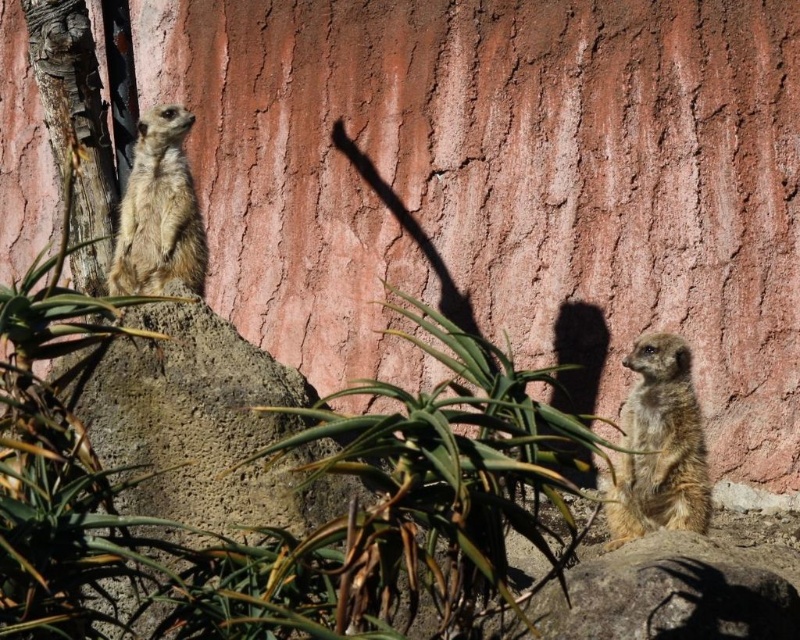
Which is in front, point (512, 396) or point (686, 356)?

Point (512, 396)

This screenshot has width=800, height=640. What do you see at coordinates (436, 490) in the screenshot?
I see `green leafy plant at center` at bounding box center [436, 490].

At what (x,y) coordinates should I click in order to perform the action: click on green leafy plant at center. Please return your answer as a coordinate pair (x, y). The image size is (800, 640). Looking at the image, I should click on pyautogui.click(x=436, y=490).

Is green leafy plant at center above golden fur meerkat at upper left?

Actually, green leafy plant at center is below golden fur meerkat at upper left.

Is green leafy plant at center shorter than golden fur meerkat at upper left?

No, green leafy plant at center is not shorter than golden fur meerkat at upper left.

Between point (505, 586) and point (182, 163), which one is positioned behind?

Point (182, 163)

Where is `green leafy plant at center`? This screenshot has height=640, width=800. green leafy plant at center is located at coordinates (436, 490).

What do you see at coordinates (660, 445) in the screenshot? I see `fuzzy brown meerkat at lower right` at bounding box center [660, 445].

Is fuzzy brown meerkat at lower right further to the viewer compared to golden fur meerkat at upper left?

No.

The height and width of the screenshot is (640, 800). I want to click on fuzzy brown meerkat at lower right, so click(660, 445).